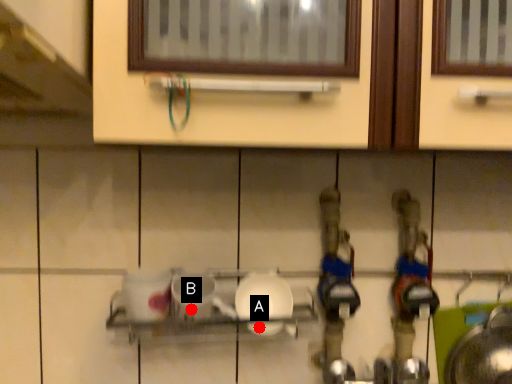
Question: Two points are circled on the image, labeled by A and B beside each circle. Which point appears closest to the camera in this image?

Choices:
 (A) A is closer
 (B) B is closer

Answer: (B)